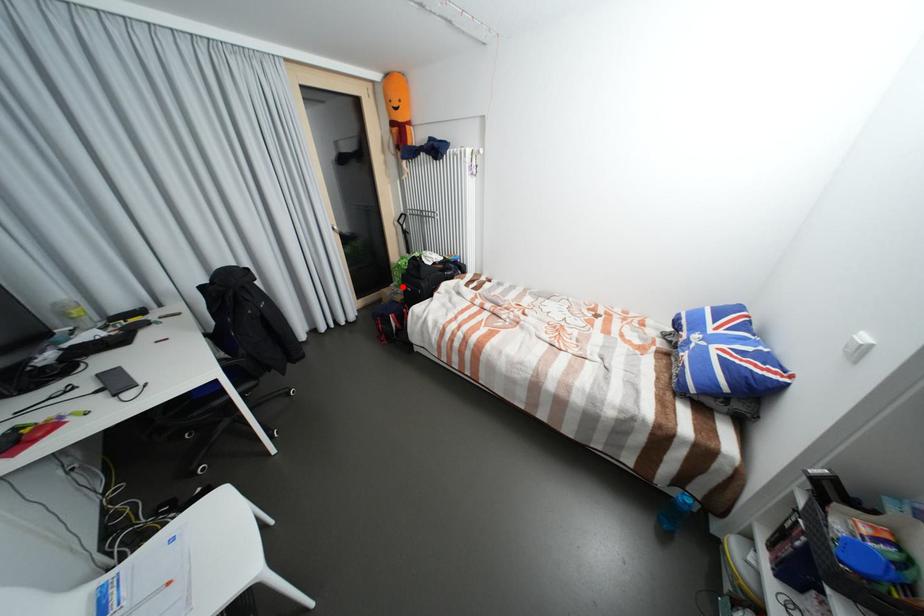
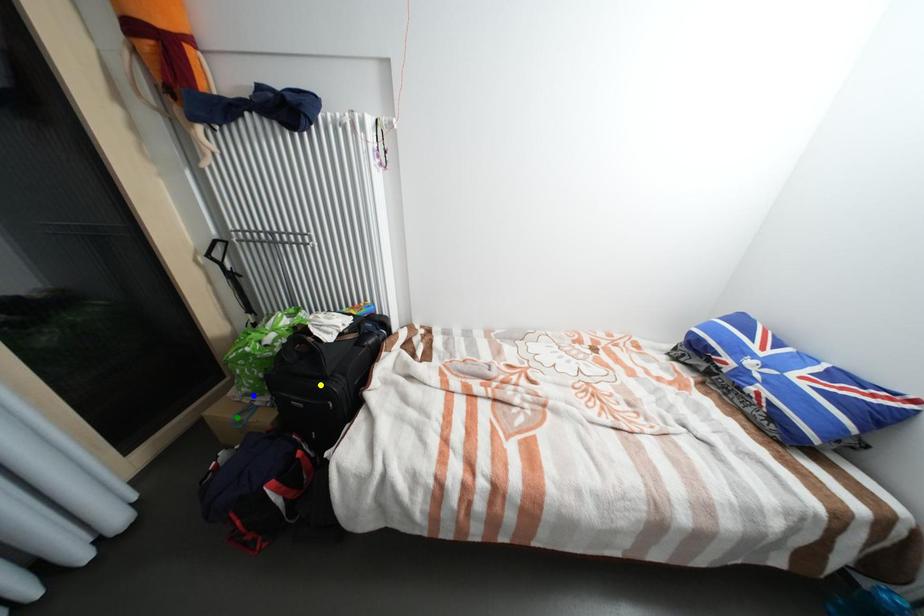
Question: I am providing you with two images of the same scene from different viewpoints. A red point is marked on the first image. You are given multiple points on the second image. Which point in image 2 represents the same 3d spot as the red point in image 1?

Choices:
 (A) blue point
 (B) yellow point
 (C) green point

Answer: (A)